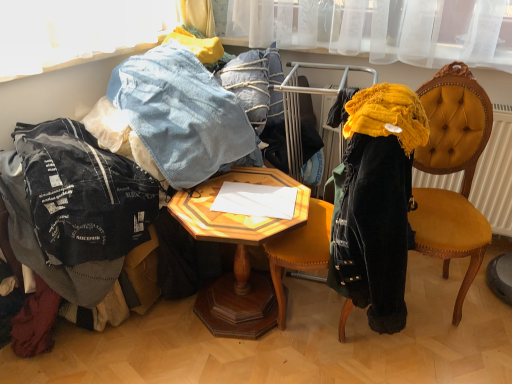
Question: Is denim at left taller or shorter than wooden hexagonal table at center?

Choices:
 (A) tall
 (B) short

Answer: (B)

Question: Considering their positions, is denim at left located in front of or behind wooden hexagonal table at center?

Choices:
 (A) behind
 (B) front

Answer: (B)

Question: Which object is positioned farthest from the velvet yellow chair at right?

Choices:
 (A) denim at left
 (B) wooden hexagonal table at center
 (C) ripped denim jacket at lower left

Answer: (C)

Question: Which is nearer to the ripped denim jacket at lower left?

Choices:
 (A) wooden hexagonal table at center
 (B) velvet yellow chair at right
 (C) denim at left

Answer: (C)